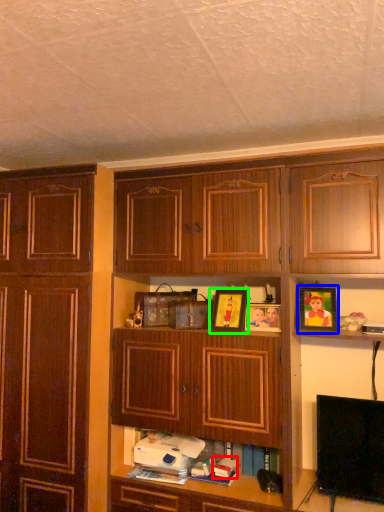
Question: Which object is the closest to the book (highlighted by a red box)? Choose among these: picture frame (highlighted by a blue box) or picture frame (highlighted by a green box).

Choices:
 (A) picture frame
 (B) picture frame

Answer: (B)